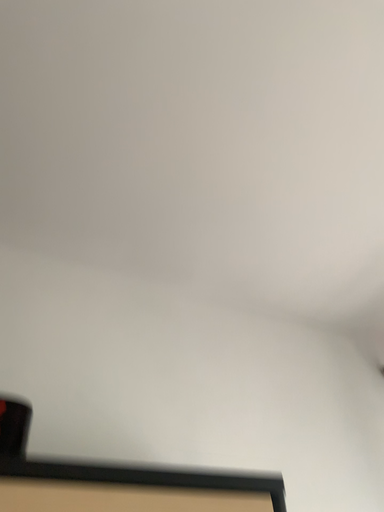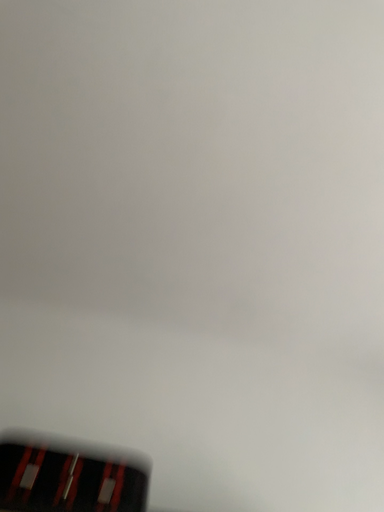
Question: How did the camera likely rotate when shooting the video?

Choices:
 (A) rotated right
 (B) rotated left

Answer: (B)